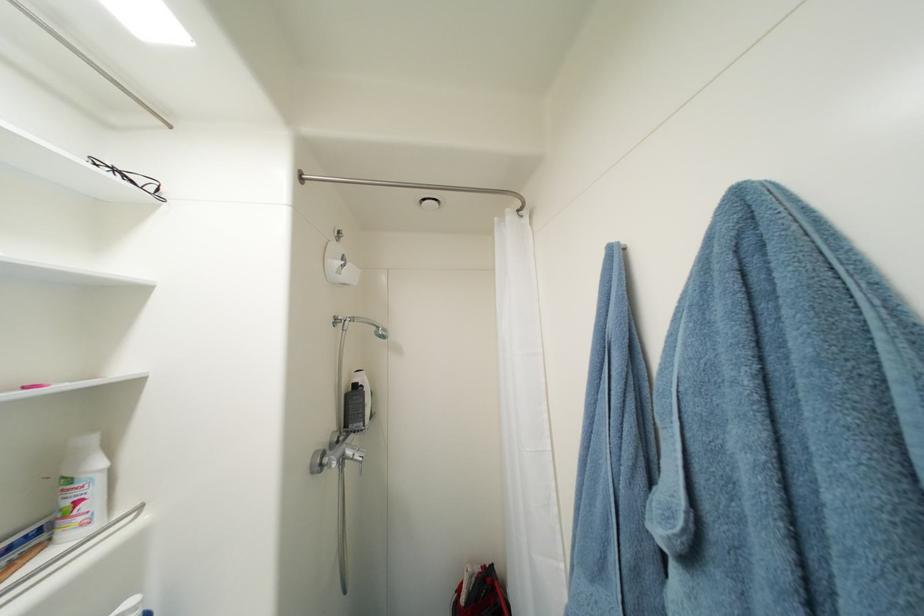
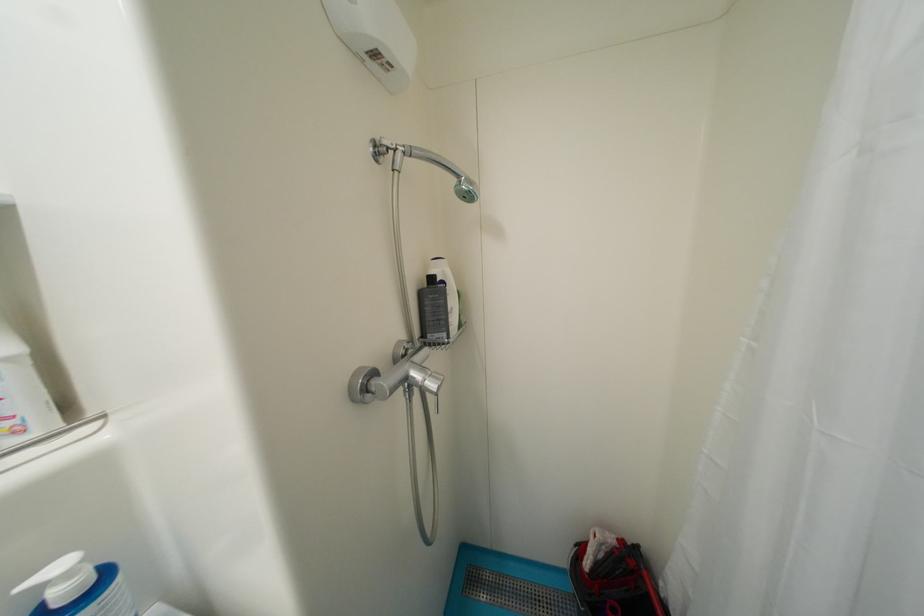
Where in the second image is the point corresponding to [390,339] from the first image?

(476, 199)